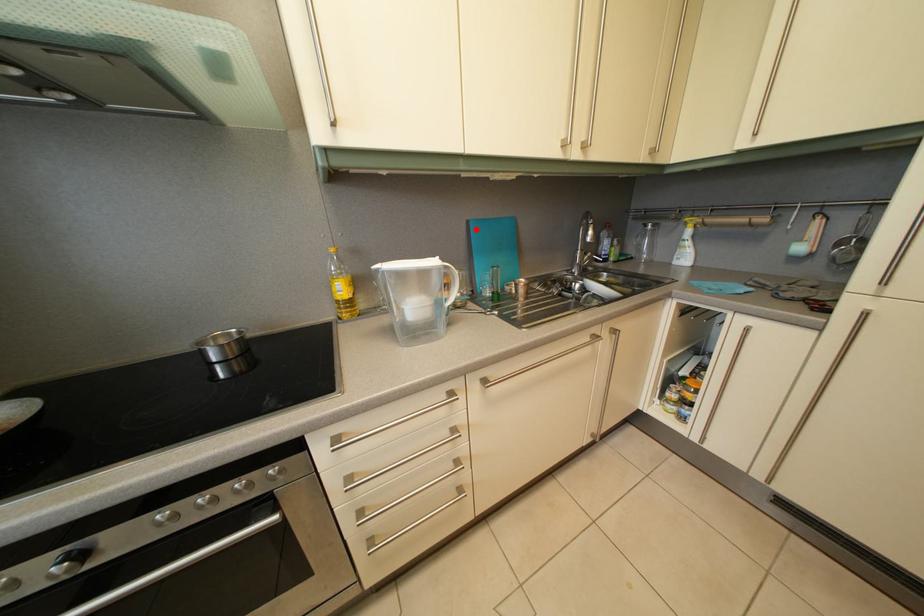
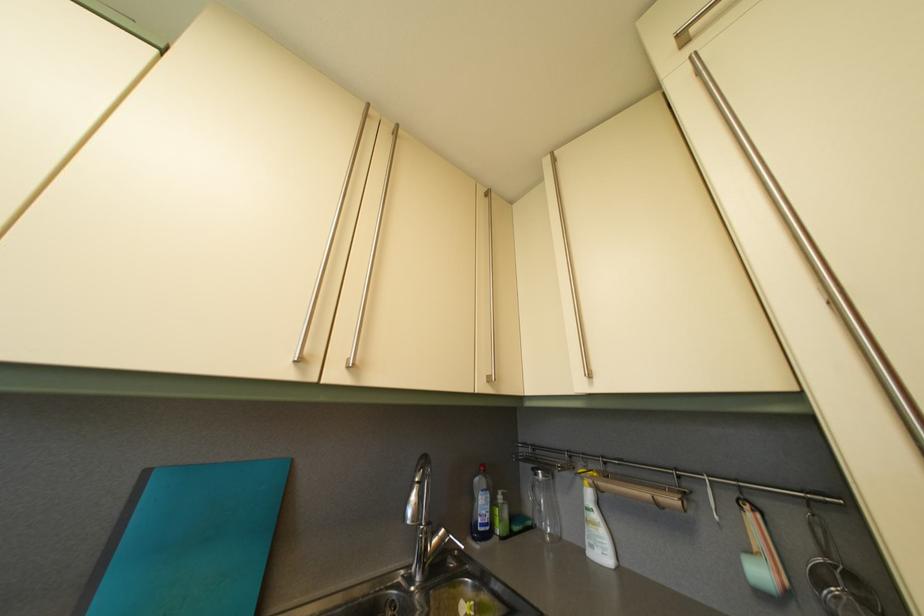
In the second image, find the point that corresponds to the highlighted location in the first image.

(154, 480)